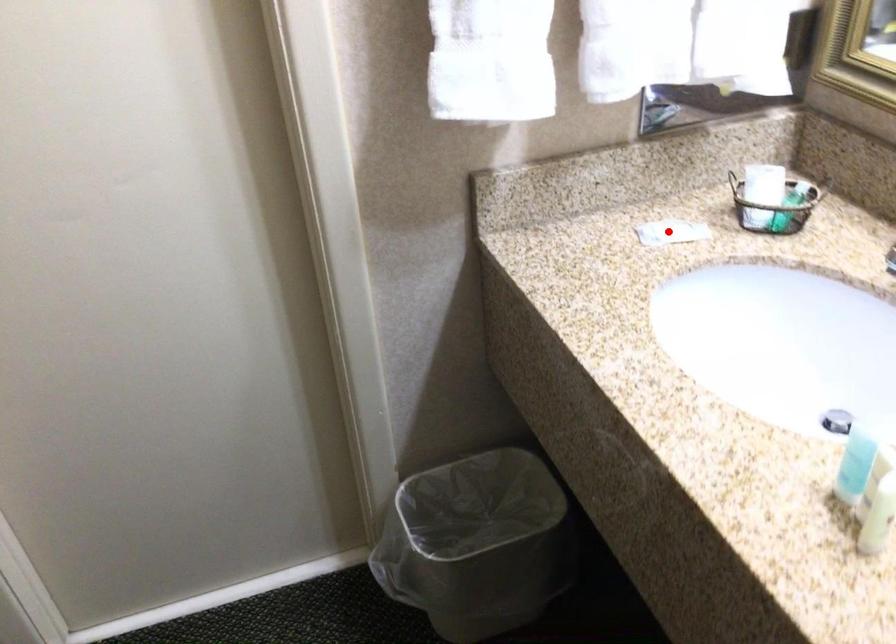
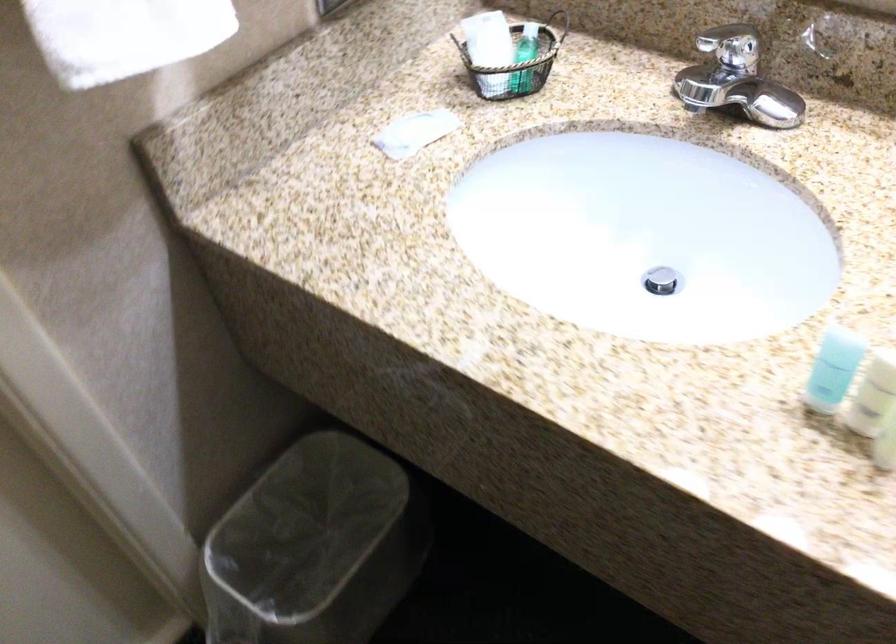
Question: I am providing you with two images of the same scene from different viewpoints. A red point is shown in image1. For the corresponding object point in image2, is it positioned nearer or farther from the camera?

Choices:
 (A) Nearer
 (B) Farther

Answer: (A)